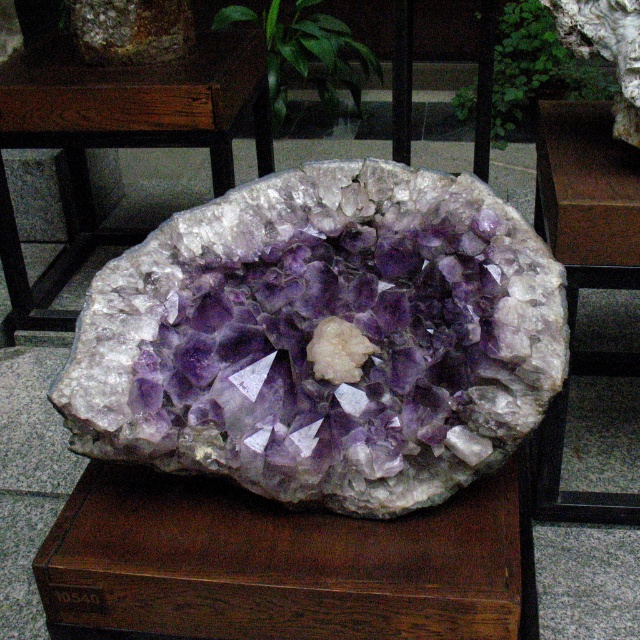
Which is above, purple crystal cluster at center or wooden table at center?

Positioned higher is wooden table at center.

Is purple crystal cluster at center bigger than wooden table at center?

Actually, purple crystal cluster at center might be smaller than wooden table at center.

Find the location of a particular element. purple crystal cluster at center is located at coordinates (321, 365).

Does purple crystal cluster at center appear under wooden box at center?

No, purple crystal cluster at center is not below wooden box at center.

Can you confirm if purple crystal cluster at center is thinner than wooden box at center?

Yes.

Which is in front, point (134, 394) or point (230, 611)?

Point (134, 394) is in front.

Find the location of a particular element. purple crystal cluster at center is located at coordinates (321, 365).

Which of these two, wooden box at center or wooden table at center, stands taller?

With more height is wooden table at center.

Where is `wooden box at center`? The height and width of the screenshot is (640, 640). wooden box at center is located at coordinates (280, 563).